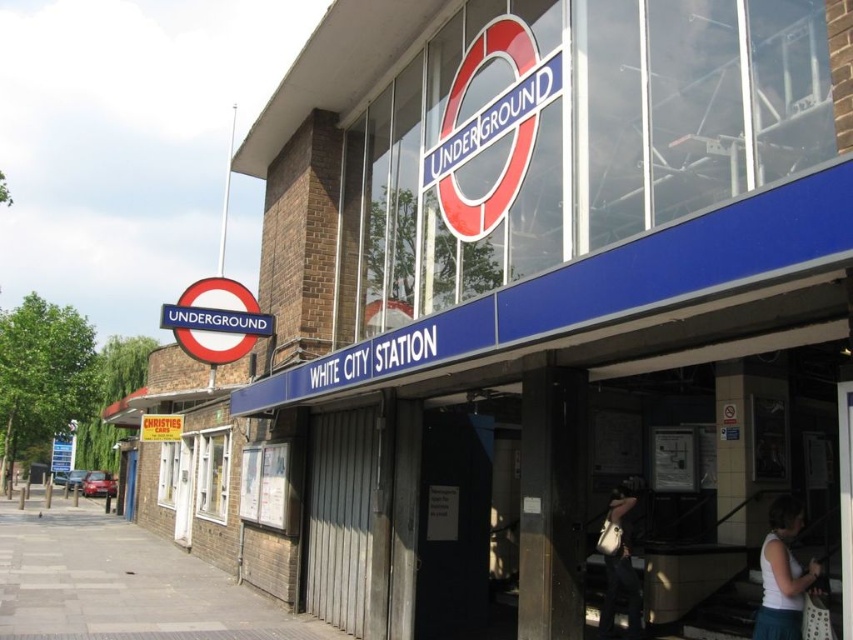
Who is more forward, (194, 570) or (612, 611)?

Positioned in front is point (612, 611).

Does point (9, 634) lie in front of point (621, 522)?

That is True.

Who is more forward, (x=51, y=518) or (x=621, y=531)?

Positioned in front is point (x=621, y=531).

Identify the location of gray concrete pavement at lower left. The height and width of the screenshot is (640, 853). (120, 582).

Looking at this image, who is more forward, (746, 260) or (785, 548)?

Point (746, 260) is more forward.

Which is in front, point (404, 113) or point (782, 589)?

Point (782, 589) is in front.

The height and width of the screenshot is (640, 853). In order to click on blue metallic signboard at center in this screenshot , I will do `click(538, 275)`.

Is gray concrete pavement at lower left smaller than white fabric bag at lower right?

Incorrect, gray concrete pavement at lower left is not smaller in size than white fabric bag at lower right.

Does point (27, 541) come closer to viewer compared to point (776, 614)?

No, (27, 541) is behind (776, 614).

Where is `gray concrete pavement at lower left`? This screenshot has height=640, width=853. gray concrete pavement at lower left is located at coordinates (120, 582).